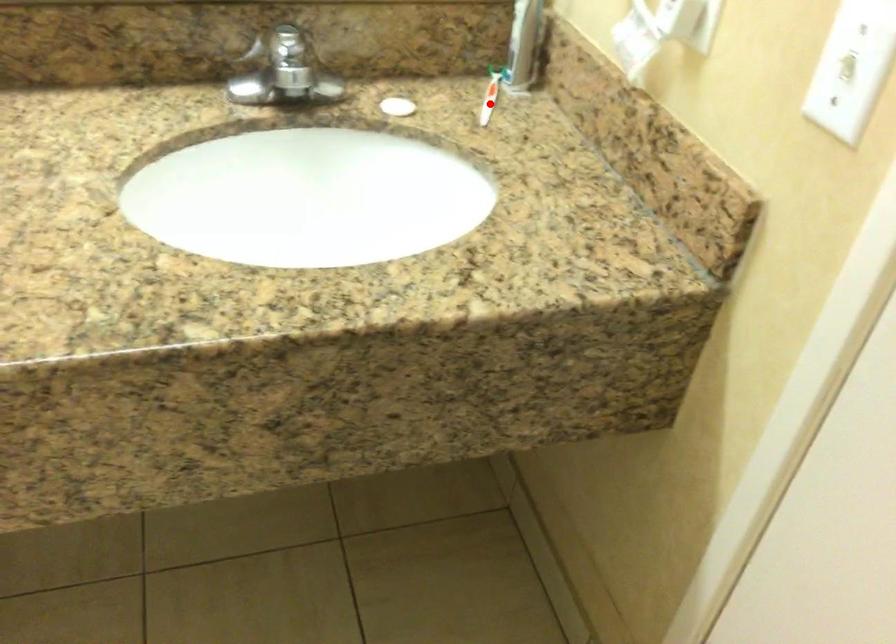
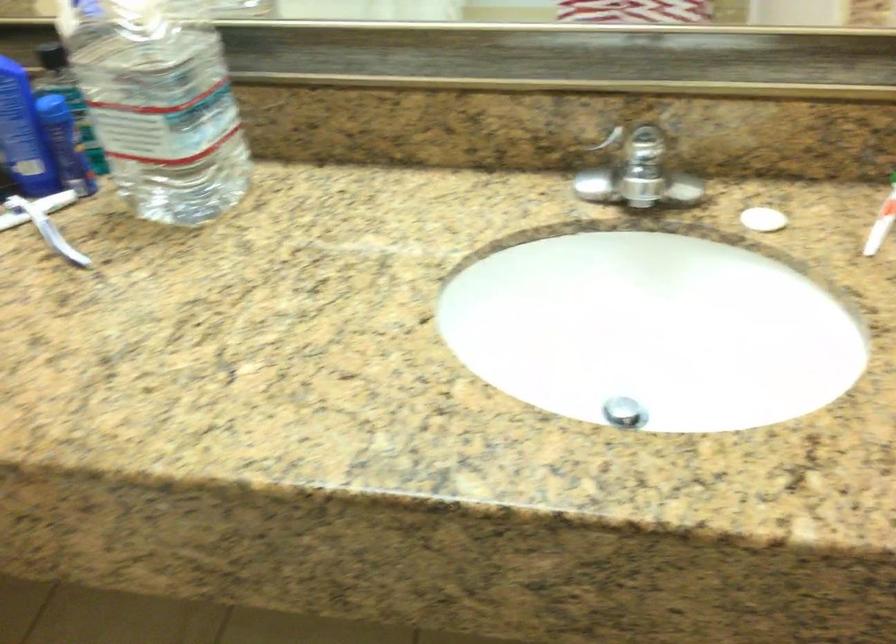
In the second image, find the point that corresponds to the highlighted location in the first image.

(881, 222)